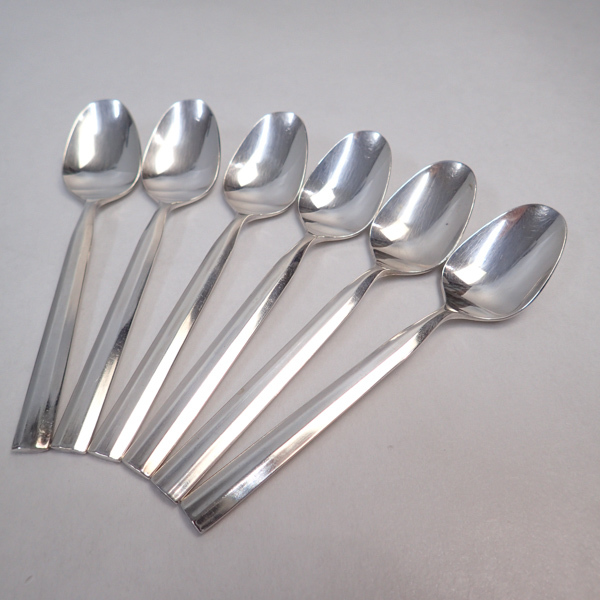
You are a GUI agent. You are given a task and a screenshot of the screen. Output one action in this format:
    pyautogui.click(x=<x>, y=<y>)
    Task: Click on the spoon handles
    Image resolution: width=600 pixels, height=600 pixels.
    Given the screenshot: What is the action you would take?
    pyautogui.click(x=49, y=366), pyautogui.click(x=93, y=396), pyautogui.click(x=124, y=410), pyautogui.click(x=154, y=446), pyautogui.click(x=179, y=477), pyautogui.click(x=207, y=504)